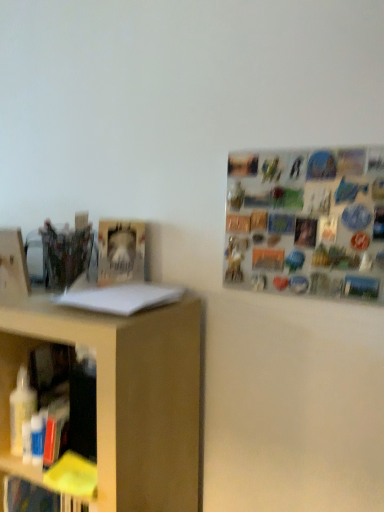
Question: Is white paper at left, which is counted as the 2th book, starting from the back, closer to camera compared to hardcover book at center-left, which is the first book from top to bottom?

Choices:
 (A) no
 (B) yes

Answer: (B)

Question: Is hardcover book at center-left, which is the first book from top to bottom, at the back of white paper at left, arranged as the 1th book when viewed from the front?

Choices:
 (A) no
 (B) yes

Answer: (A)

Question: Does white paper at left, the first book in the bottom-to-top sequence, have a smaller size compared to hardcover book at center-left, the first book in the back-to-front sequence?

Choices:
 (A) no
 (B) yes

Answer: (B)

Question: From the image's perspective, is white paper at left, arranged as the 1th book when viewed from the front, located above hardcover book at center-left, the first book in the back-to-front sequence?

Choices:
 (A) yes
 (B) no

Answer: (B)

Question: Considering the relative positions of white paper at left, the first book in the bottom-to-top sequence, and hardcover book at center-left, which is the first book from top to bottom, in the image provided, is white paper at left, the first book in the bottom-to-top sequence, to the left of hardcover book at center-left, which is the first book from top to bottom, from the viewer's perspective?

Choices:
 (A) no
 (B) yes

Answer: (A)

Question: In terms of height, does hardcover book at center-left, arranged as the second book when viewed from the front, look taller or shorter compared to white paper at left, which is counted as the 2th book, starting from the back?

Choices:
 (A) tall
 (B) short

Answer: (A)

Question: From the image's perspective, is hardcover book at center-left, arranged as the second book when viewed from the front, positioned above or below white paper at left, the 2th book viewed from the top?

Choices:
 (A) below
 (B) above

Answer: (B)

Question: Visually, is hardcover book at center-left, which is the first book from top to bottom, positioned to the left or to the right of white paper at left, arranged as the 1th book when viewed from the front?

Choices:
 (A) right
 (B) left

Answer: (B)

Question: From a real-world perspective, is hardcover book at center-left, arranged as the second book when viewed from the front, positioned above or below white paper at left, the 2th book viewed from the top?

Choices:
 (A) above
 (B) below

Answer: (A)

Question: Is metallic silver magnets at upper right wider or thinner than white paper at left, which is counted as the 2th book, starting from the back?

Choices:
 (A) wide
 (B) thin

Answer: (B)

Question: Is point pyautogui.click(x=274, y=202) positioned closer to the camera than point pyautogui.click(x=71, y=290)?

Choices:
 (A) closer
 (B) farther

Answer: (A)

Question: Choose the correct answer: Is metallic silver magnets at upper right inside white paper at left, arranged as the 1th book when viewed from the front, or outside it?

Choices:
 (A) inside
 (B) outside

Answer: (B)

Question: From the image's perspective, is metallic silver magnets at upper right positioned above or below white paper at left, the first book in the bottom-to-top sequence?

Choices:
 (A) below
 (B) above

Answer: (B)

Question: Is white paper at left, which is counted as the 2th book, starting from the back, taller or shorter than hardcover book at center-left, arranged as the second book when viewed from the front?

Choices:
 (A) short
 (B) tall

Answer: (A)

Question: From the image's perspective, relative to hardcover book at center-left, which appears as the second book when ordered from the bottom, is white paper at left, which is counted as the 2th book, starting from the back, above or below?

Choices:
 (A) above
 (B) below

Answer: (B)